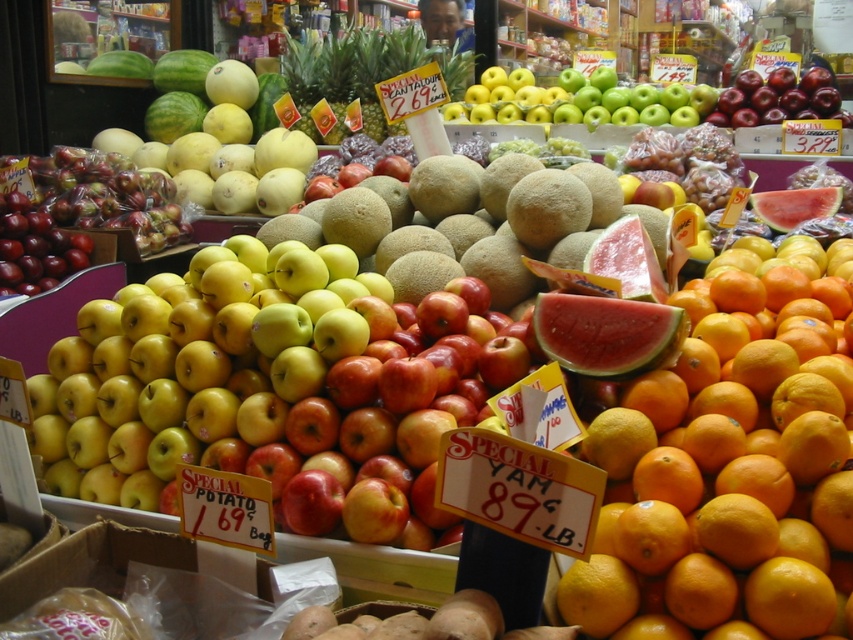
At what (x,y) coordinates should I click in order to perform the action: click on shiny red apple at left. Please return your answer as a coordinate pair (x, y). This screenshot has width=853, height=640. Looking at the image, I should click on tap(35, 248).

Is shiny red apple at left wider than watermelon rind at upper right?

In fact, shiny red apple at left might be narrower than watermelon rind at upper right.

Is point (42, 225) farther from viewer compared to point (834, 202)?

Yes, it is.

Identify the location of shiny red apple at left. (35, 248).

Is point (62, 467) farther from camera compared to point (15, 266)?

No, (62, 467) is in front of (15, 266).

Measure the distance between yellow matte apples at center and camera.

yellow matte apples at center and camera are 4.91 feet apart.

Identify the location of yellow matte apples at center. pos(273,394).

Consider the image. Does shiny red apple at upper right have a smaller size compared to smooth yellow orange at center?

No, shiny red apple at upper right is not smaller than smooth yellow orange at center.

How much distance is there between shiny red apple at upper right and smooth yellow orange at center?

3.35 meters

What are the coordinates of `shiny red apple at upper right` in the screenshot? It's located at (776, 99).